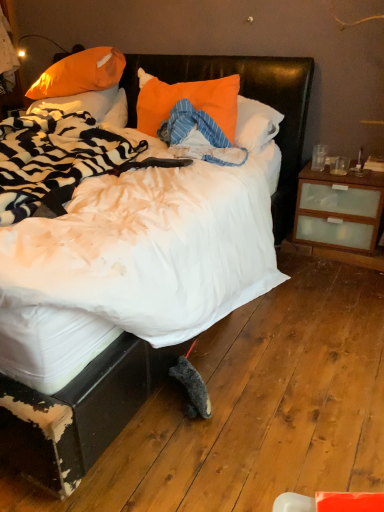
Question: Is the depth of white soft bed at center less than that of orange fabric pillow at upper left, which appears as the second pillow when viewed from the left?

Choices:
 (A) no
 (B) yes

Answer: (B)

Question: From the image's perspective, is white soft bed at center on top of orange fabric pillow at upper left, which appears as the second pillow when viewed from the left?

Choices:
 (A) no
 (B) yes

Answer: (A)

Question: Would you consider white soft bed at center to be distant from orange fabric pillow at upper left, the second pillow viewed from the right?

Choices:
 (A) yes
 (B) no

Answer: (B)

Question: Is orange fabric pillow at upper left, which appears as the second pillow when viewed from the left, at the back of white soft bed at center?

Choices:
 (A) no
 (B) yes

Answer: (B)

Question: Does white soft bed at center have a greater height compared to orange fabric pillow at upper left, which appears as the second pillow when viewed from the left?

Choices:
 (A) no
 (B) yes

Answer: (B)

Question: Is point (31, 90) closer or farther from the camera than point (76, 109)?

Choices:
 (A) farther
 (B) closer

Answer: (A)

Question: Looking at the image, does orange fabric pillow at upper left, the second pillow viewed from the right, seem bigger or smaller compared to orange fabric pillow at upper left, positioned as the 1th pillow in left-to-right order?

Choices:
 (A) big
 (B) small

Answer: (A)

Question: Considering the relative positions of orange fabric pillow at upper left, which appears as the second pillow when viewed from the left, and orange fabric pillow at upper left, positioned as the 1th pillow in left-to-right order, in the image provided, is orange fabric pillow at upper left, which appears as the second pillow when viewed from the left, to the left or to the right of orange fabric pillow at upper left, positioned as the 1th pillow in left-to-right order,?

Choices:
 (A) right
 (B) left

Answer: (A)

Question: Is orange fabric pillow at upper left, which appears as the second pillow when viewed from the left, spatially inside orange fabric pillow at upper left, the third pillow from the right, or outside of it?

Choices:
 (A) inside
 (B) outside

Answer: (B)

Question: Is orange fabric pillow at center, the third pillow positioned from the left, to the left or to the right of orange fabric pillow at upper left, the third pillow from the right, in the image?

Choices:
 (A) right
 (B) left

Answer: (A)

Question: From a real-world perspective, relative to orange fabric pillow at upper left, the third pillow from the right, is orange fabric pillow at center, the third pillow positioned from the left, vertically above or below?

Choices:
 (A) below
 (B) above

Answer: (B)

Question: Looking at the image, does orange fabric pillow at center, the third pillow positioned from the left, seem bigger or smaller compared to orange fabric pillow at upper left, the third pillow from the right?

Choices:
 (A) big
 (B) small

Answer: (B)

Question: Relative to orange fabric pillow at upper left, the third pillow from the right, is orange fabric pillow at center, the third pillow positioned from the left, in front or behind?

Choices:
 (A) front
 (B) behind

Answer: (A)

Question: Considering the positions of orange fabric pillow at upper left, which appears as the second pillow when viewed from the left, and orange fabric pillow at center, which is the 1th pillow from right to left, in the image, is orange fabric pillow at upper left, which appears as the second pillow when viewed from the left, wider or thinner than orange fabric pillow at center, which is the 1th pillow from right to left,?

Choices:
 (A) thin
 (B) wide

Answer: (B)

Question: From their relative heights in the image, would you say orange fabric pillow at upper left, the second pillow viewed from the right, is taller or shorter than orange fabric pillow at center, the third pillow positioned from the left?

Choices:
 (A) short
 (B) tall

Answer: (A)